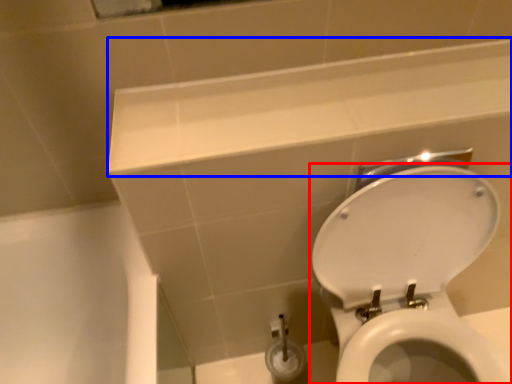
Question: Which object appears farthest to the camera in this image, toilet (highlighted by a red box) or ledge (highlighted by a blue box)?

Choices:
 (A) toilet
 (B) ledge

Answer: (B)